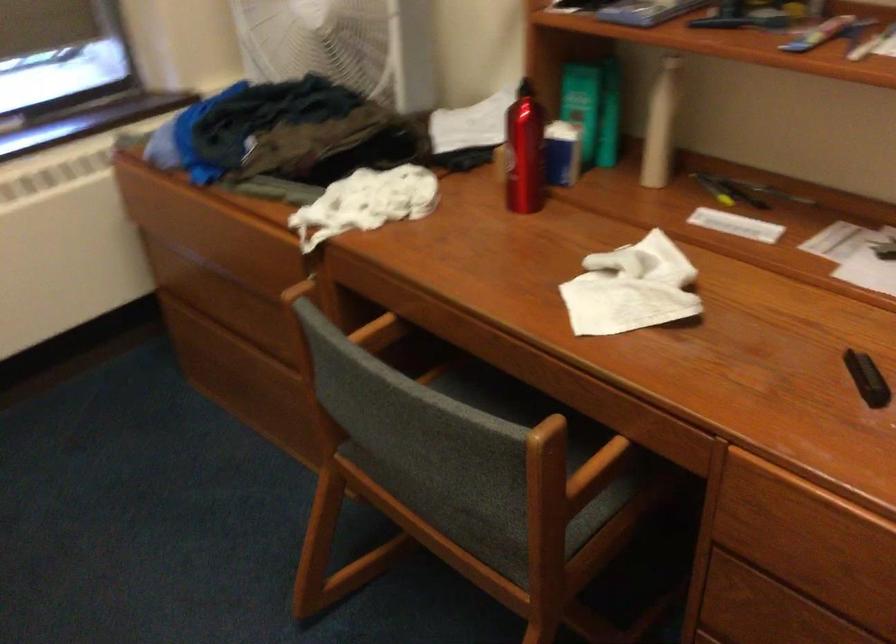
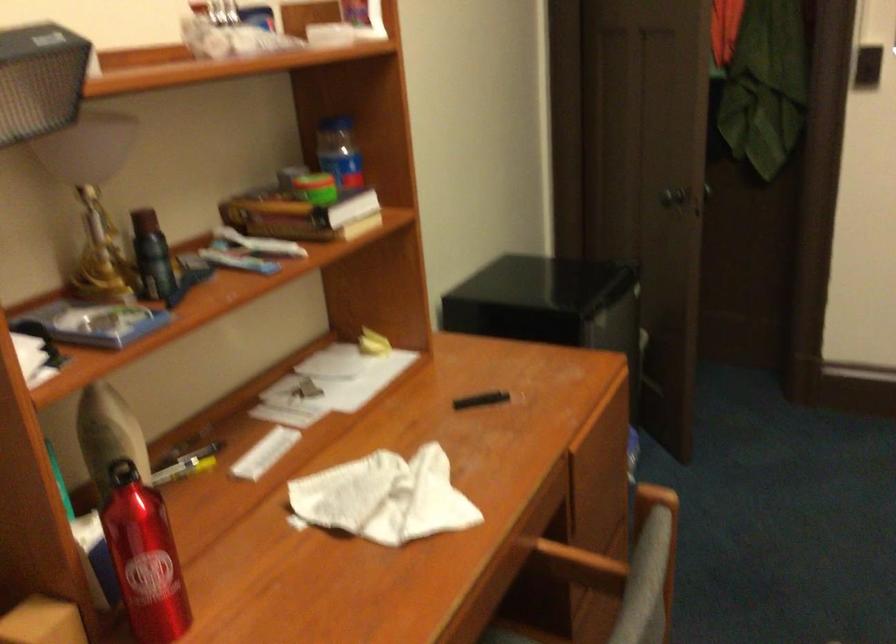
Find the pixel in the second image that matches (x=509, y=140) in the first image.

(143, 558)